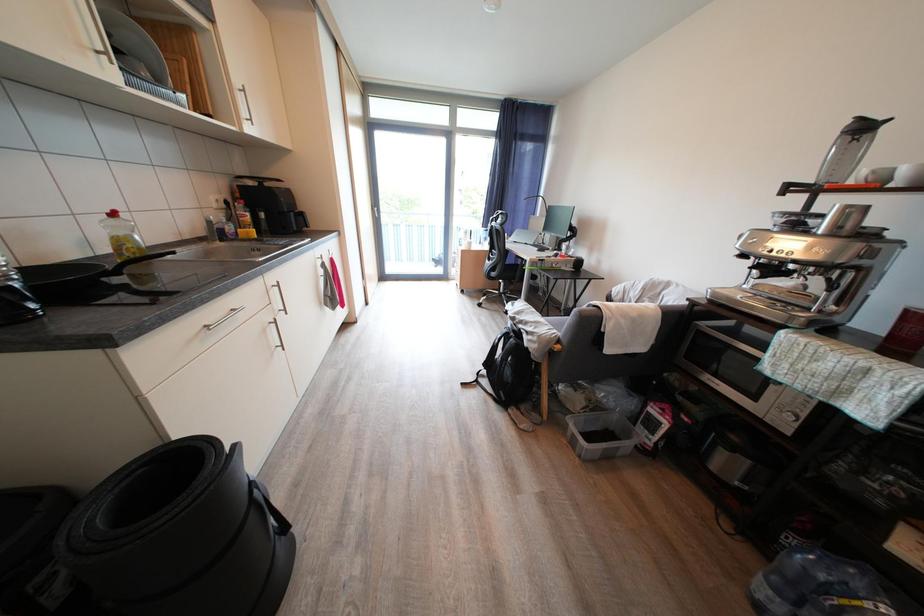
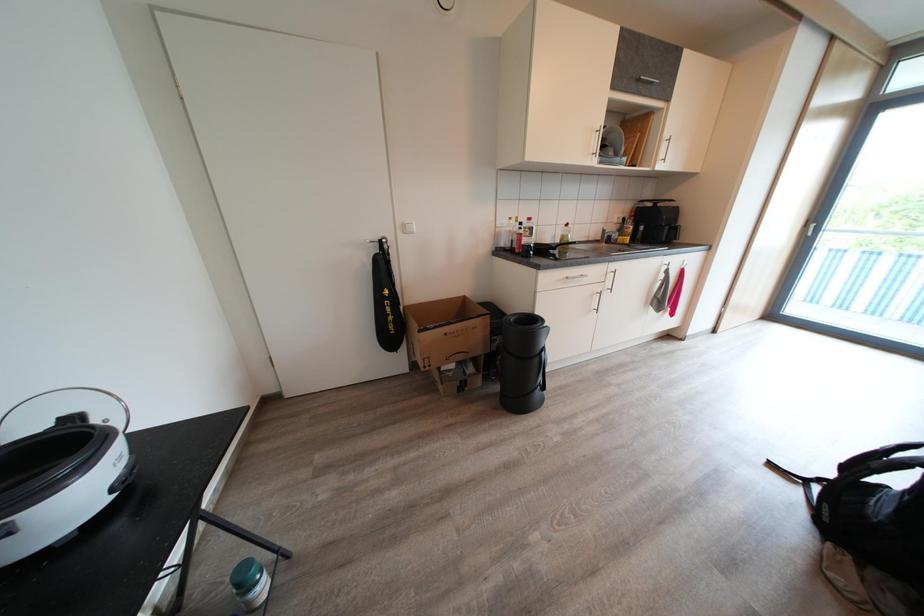
Question: The camera is either moving clockwise (left) or counter-clockwise (right) around the object. The first image is from the beginning of the video and the second image is from the end. Is the camera moving left or right when shooting the video?

Choices:
 (A) Left
 (B) Right

Answer: (B)